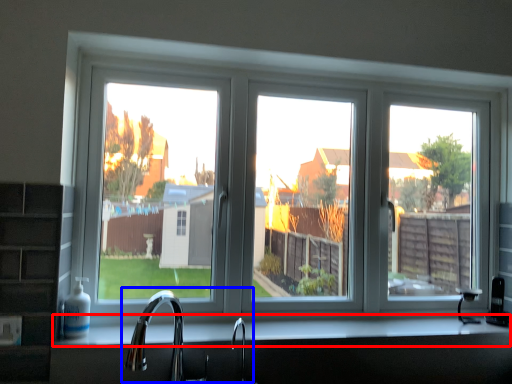
Question: Which object appears farthest to the camera in this image, counter top (highlighted by a red box) or sink (highlighted by a blue box)?

Choices:
 (A) counter top
 (B) sink

Answer: (A)